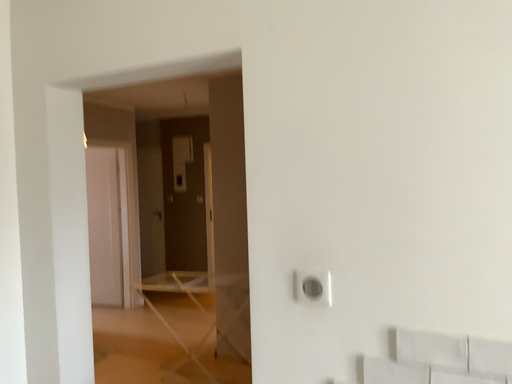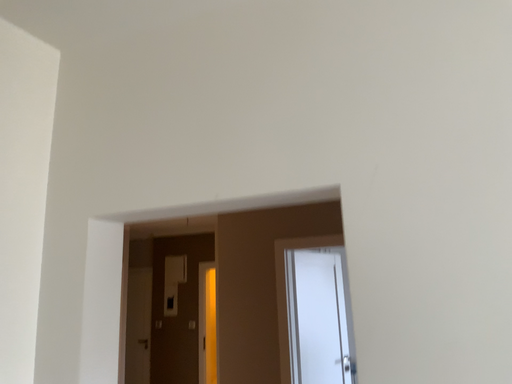
Question: Which way did the camera rotate in the video?

Choices:
 (A) rotated upward
 (B) rotated downward

Answer: (A)